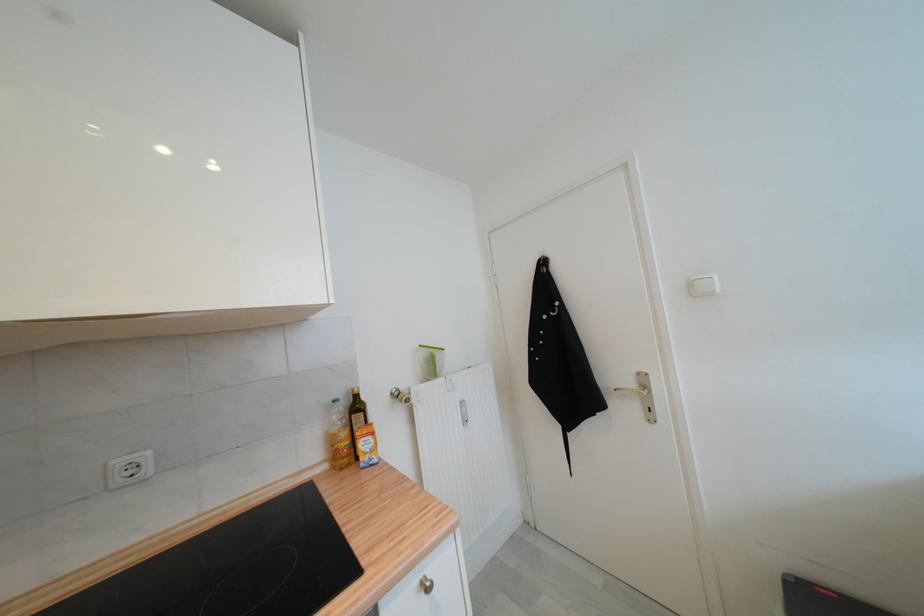
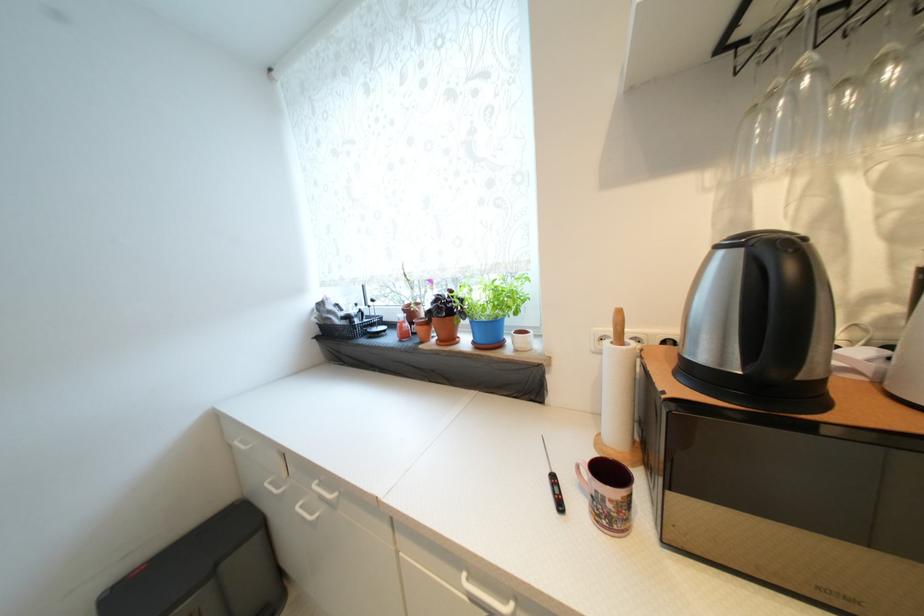
Question: The camera is either moving clockwise (left) or counter-clockwise (right) around the object. The first image is from the beginning of the video and the second image is from the end. Is the camera moving left or right when shooting the video?

Choices:
 (A) Left
 (B) Right

Answer: (A)